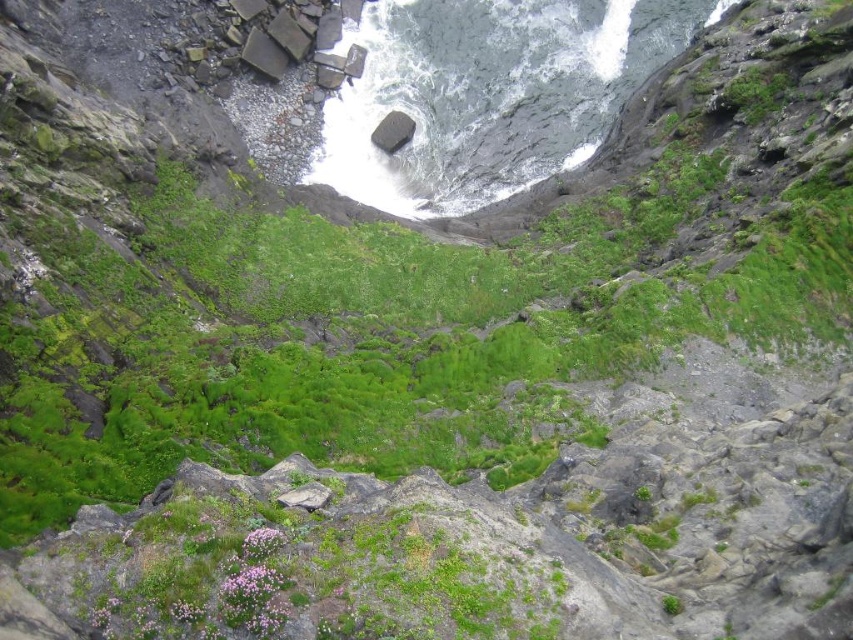
Between point (631, 44) and point (309, 497), which one is positioned behind?

Positioned behind is point (631, 44).

Can you confirm if white frothy water at center is wider than gray rough stone at center?

Yes.

Where is `white frothy water at center`? Image resolution: width=853 pixels, height=640 pixels. white frothy water at center is located at coordinates (489, 93).

Between point (656, 32) and point (390, 152), which one is positioned in front?

Point (390, 152) is more forward.

Is white frothy water at center to the left of smooth gray rock at center from the viewer's perspective?

In fact, white frothy water at center is to the right of smooth gray rock at center.

Which is behind, point (368, 49) or point (386, 152)?

Positioned behind is point (368, 49).

Locate an element on the screen. white frothy water at center is located at coordinates (489, 93).

Which of these two, smooth gray rock at center or gray rough stone at center, stands shorter?

Standing shorter between the two is gray rough stone at center.

Between smooth gray rock at center and gray rough stone at center, which one appears on the right side from the viewer's perspective?

smooth gray rock at center

Is point (386, 150) positioned after point (312, 508)?

Yes, it is.

The image size is (853, 640). I want to click on smooth gray rock at center, so click(x=392, y=131).